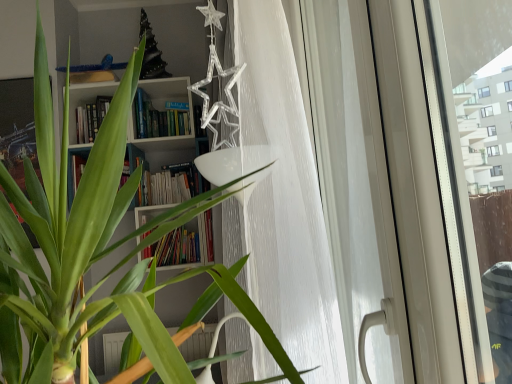
Question: Looking at the image, does white textured curtain at center seem bigger or smaller compared to white glossy screen door at right?

Choices:
 (A) big
 (B) small

Answer: (A)

Question: Considering their positions, is white textured curtain at center located in front of or behind white glossy screen door at right?

Choices:
 (A) behind
 (B) front

Answer: (A)

Question: Visually, is white textured curtain at center positioned to the left or to the right of white glossy screen door at right?

Choices:
 (A) left
 (B) right

Answer: (A)

Question: Is white glossy screen door at right to the left or to the right of white textured curtain at center in the image?

Choices:
 (A) left
 (B) right

Answer: (B)

Question: Is white glossy screen door at right bigger or smaller than white textured curtain at center?

Choices:
 (A) big
 (B) small

Answer: (B)

Question: From the image's perspective, is white glossy screen door at right positioned above or below white textured curtain at center?

Choices:
 (A) below
 (B) above

Answer: (A)

Question: Relative to white textured curtain at center, is white glossy screen door at right in front or behind?

Choices:
 (A) behind
 (B) front

Answer: (B)